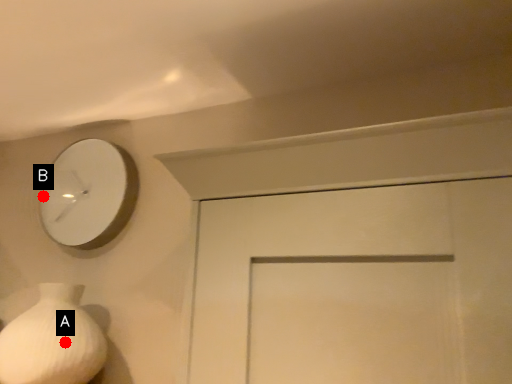
Question: Two points are circled on the image, labeled by A and B beside each circle. Which point is further to the camera?

Choices:
 (A) A is further
 (B) B is further

Answer: (B)